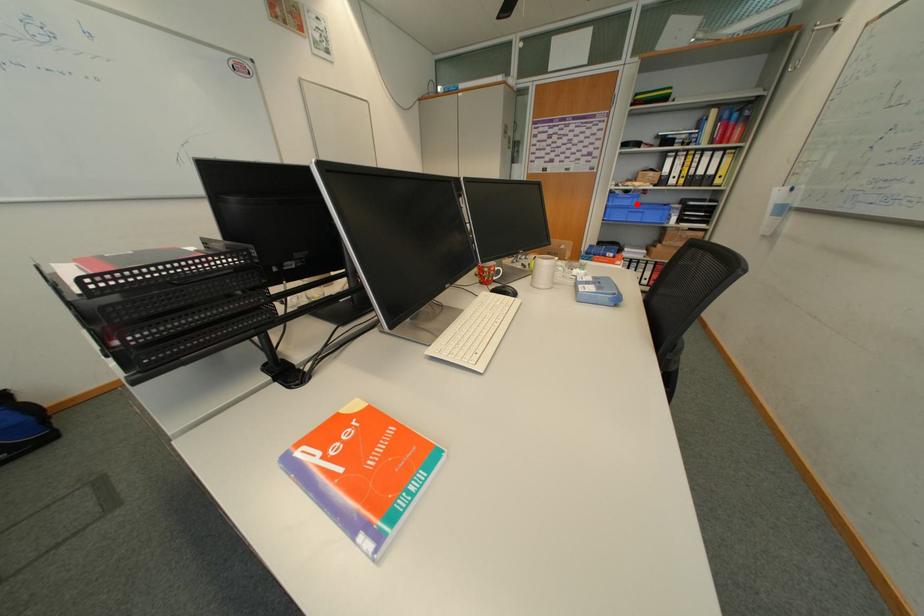
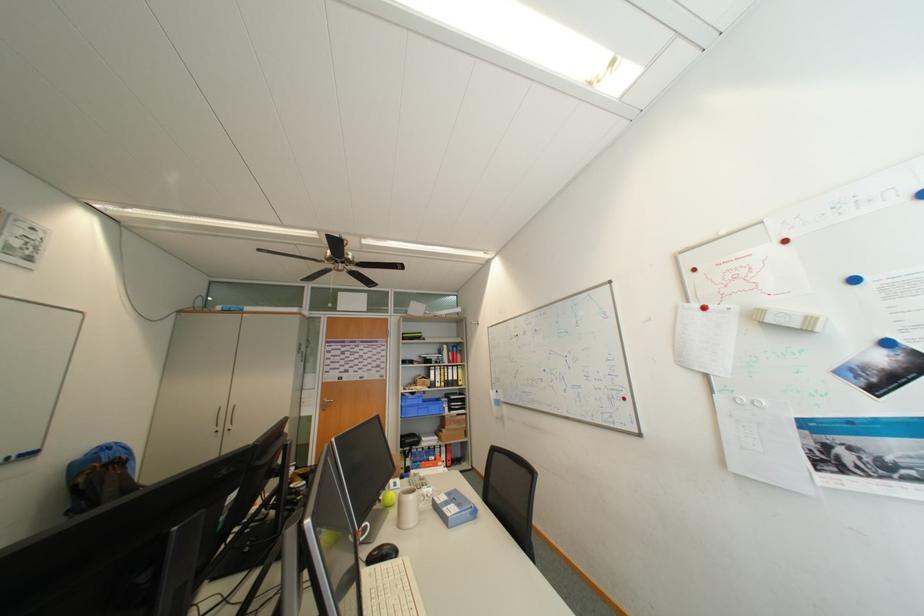
In the second image, find the point that corresponds to the highlighted location in the first image.

(426, 403)